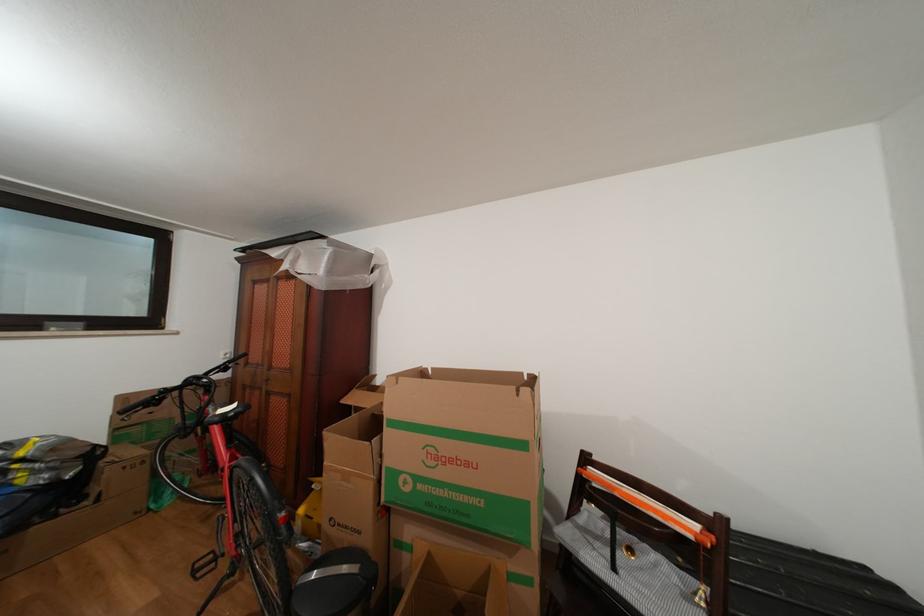
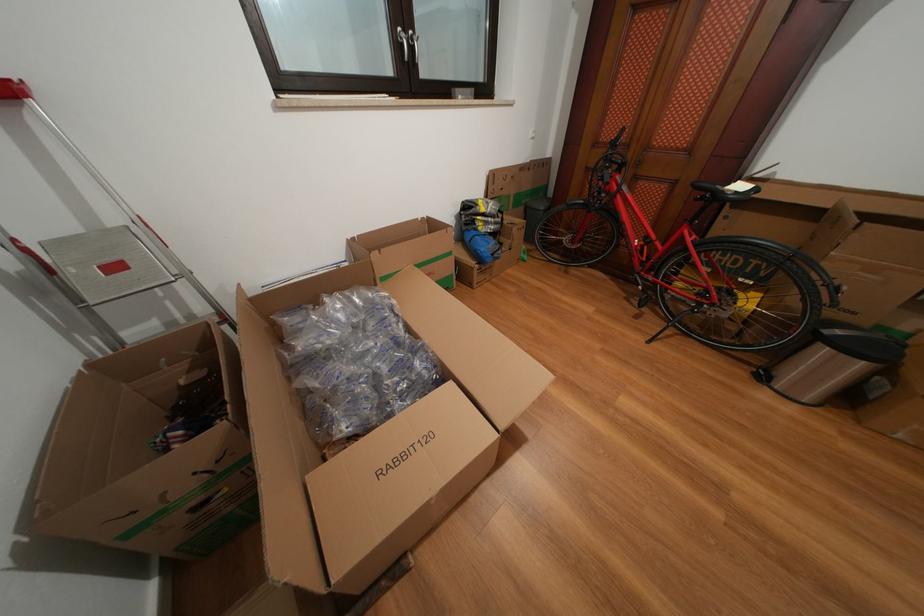
Where in the second image is the point corresponding to (x=30, y=459) from the first image?

(491, 215)